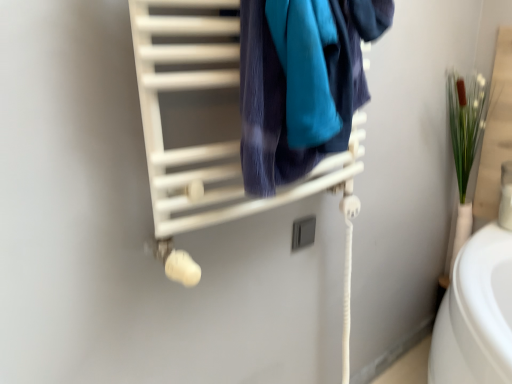
Question: Is matte white towel rack at upper center positioned far away from velvety blue towel at center?

Choices:
 (A) no
 (B) yes

Answer: (A)

Question: Is matte white towel rack at upper center in contact with velvety blue towel at center?

Choices:
 (A) yes
 (B) no

Answer: (B)

Question: Is matte white towel rack at upper center smaller than velvety blue towel at center?

Choices:
 (A) no
 (B) yes

Answer: (B)

Question: Considering the relative positions of matte white towel rack at upper center and velvety blue towel at center in the image provided, is matte white towel rack at upper center to the left of velvety blue towel at center from the viewer's perspective?

Choices:
 (A) no
 (B) yes

Answer: (B)

Question: Is matte white towel rack at upper center positioned with its back to velvety blue towel at center?

Choices:
 (A) no
 (B) yes

Answer: (A)

Question: From a real-world perspective, does matte white towel rack at upper center stand above velvety blue towel at center?

Choices:
 (A) yes
 (B) no

Answer: (B)

Question: Is velvety blue towel at center in contact with matte white towel rack at upper center?

Choices:
 (A) yes
 (B) no

Answer: (B)

Question: Considering the relative sizes of velvety blue towel at center and matte white towel rack at upper center in the image provided, is velvety blue towel at center shorter than matte white towel rack at upper center?

Choices:
 (A) no
 (B) yes

Answer: (A)

Question: From a real-world perspective, is velvety blue towel at center positioned over matte white towel rack at upper center based on gravity?

Choices:
 (A) yes
 (B) no

Answer: (A)

Question: Is velvety blue towel at center far from matte white towel rack at upper center?

Choices:
 (A) no
 (B) yes

Answer: (A)

Question: Is velvety blue towel at center in front of matte white towel rack at upper center?

Choices:
 (A) no
 (B) yes

Answer: (A)

Question: Considering the relative sizes of velvety blue towel at center and matte white towel rack at upper center in the image provided, is velvety blue towel at center smaller than matte white towel rack at upper center?

Choices:
 (A) yes
 (B) no

Answer: (B)

Question: In terms of height, does velvety blue towel at center look taller or shorter compared to matte white towel rack at upper center?

Choices:
 (A) short
 (B) tall

Answer: (B)